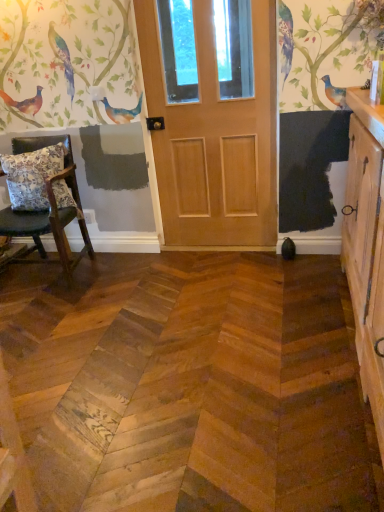
Question: Is wooden cabinet at right facing towards floral fabric cushion at left?

Choices:
 (A) no
 (B) yes

Answer: (B)

Question: From a real-world perspective, is wooden cabinet at right on top of floral fabric cushion at left?

Choices:
 (A) no
 (B) yes

Answer: (A)

Question: Does wooden cabinet at right come behind floral fabric cushion at left?

Choices:
 (A) no
 (B) yes

Answer: (A)

Question: Does wooden cabinet at right have a smaller size compared to floral fabric cushion at left?

Choices:
 (A) yes
 (B) no

Answer: (B)

Question: Is wooden cabinet at right in contact with floral fabric cushion at left?

Choices:
 (A) no
 (B) yes

Answer: (A)

Question: In terms of height, does natural wood door at center look taller or shorter compared to wooden chair with cushion at left?

Choices:
 (A) short
 (B) tall

Answer: (B)

Question: In terms of width, does natural wood door at center look wider or thinner when compared to wooden chair with cushion at left?

Choices:
 (A) thin
 (B) wide

Answer: (A)

Question: From the image's perspective, is natural wood door at center positioned above or below wooden chair with cushion at left?

Choices:
 (A) below
 (B) above

Answer: (B)

Question: Is natural wood door at center in front of or behind wooden chair with cushion at left in the image?

Choices:
 (A) front
 (B) behind

Answer: (B)

Question: Considering the positions of wooden cabinet at right and floral fabric cushion at left in the image, is wooden cabinet at right taller or shorter than floral fabric cushion at left?

Choices:
 (A) tall
 (B) short

Answer: (A)

Question: From the image's perspective, relative to floral fabric cushion at left, is wooden cabinet at right above or below?

Choices:
 (A) above
 (B) below

Answer: (B)

Question: Considering the positions of wooden cabinet at right and floral fabric cushion at left in the image, is wooden cabinet at right bigger or smaller than floral fabric cushion at left?

Choices:
 (A) small
 (B) big

Answer: (B)

Question: Would you say wooden cabinet at right is inside or outside floral fabric cushion at left?

Choices:
 (A) inside
 (B) outside

Answer: (B)

Question: Looking at their shapes, would you say floral fabric cushion at left is wider or thinner than wooden chair with cushion at left?

Choices:
 (A) thin
 (B) wide

Answer: (A)

Question: From a real-world perspective, is floral fabric cushion at left above or below wooden chair with cushion at left?

Choices:
 (A) above
 (B) below

Answer: (A)